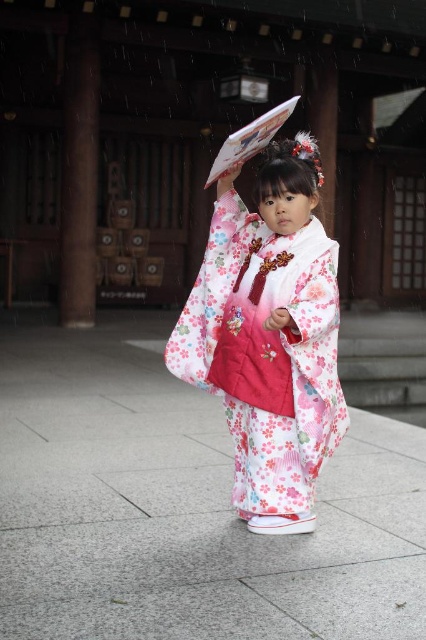
You are a photographer trying to capture the child in the center of the image. Since you want to focus on the child, you need to ensure the gray concrete pavement at center and the floral silk kimono at center do not block the view. Which object should you move closer to the camera to make the other appear smaller?

To make the gray concrete pavement at center appear smaller, you should move the floral silk kimono at center closer to the camera. Since the gray concrete pavement at center is larger in size than the floral silk kimono at center, moving the kimono forward will reduce the pavement size in the frame.

You are a photographer taking a picture of the gray concrete pavement at center and the floral silk kimono at center. Based on their positions, which object should you focus on first if you want to capture both in the same frame?

The gray concrete pavement at center is to the left of the floral silk kimono at center, so you should focus on the gray concrete pavement at center first to ensure both are in the frame.